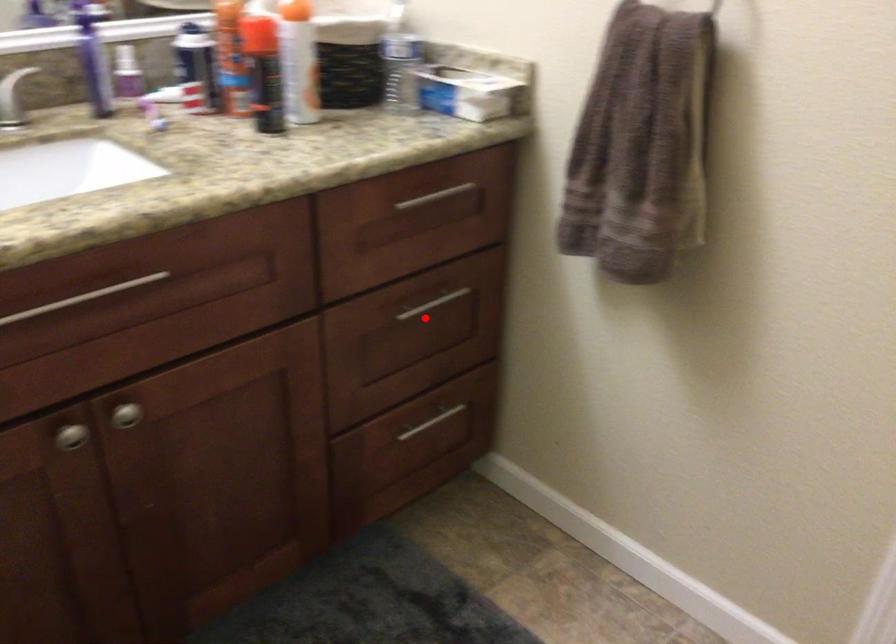
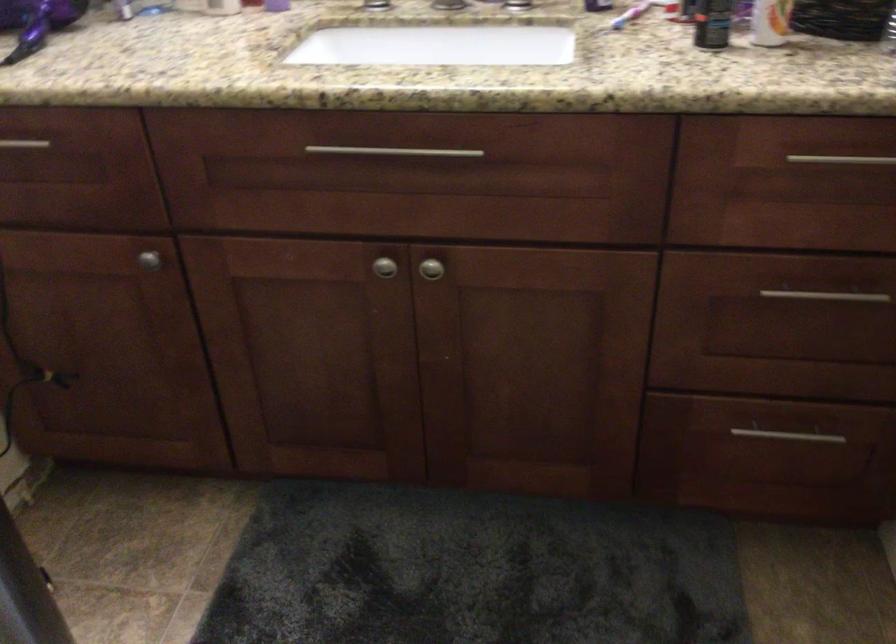
Locate, in the second image, the point that corresponds to the highlighted location in the first image.

(815, 310)